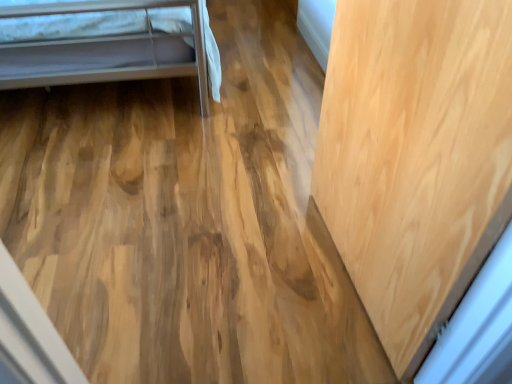
Locate an element on the screen. The width and height of the screenshot is (512, 384). free point to the left of light wood door at right is located at coordinates (240, 260).